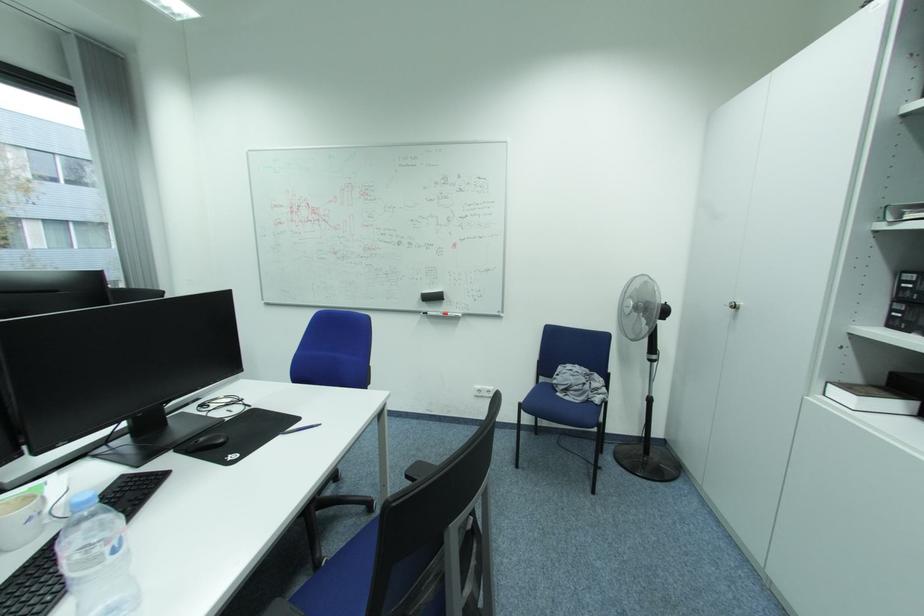
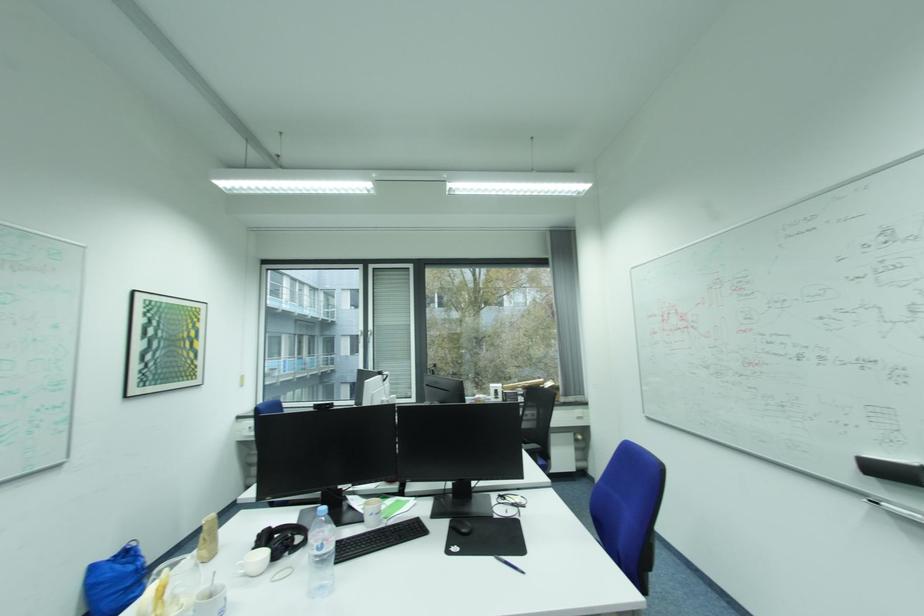
The point at (184, 453) is marked in the first image. Where is the corresponding point in the second image?

(458, 522)